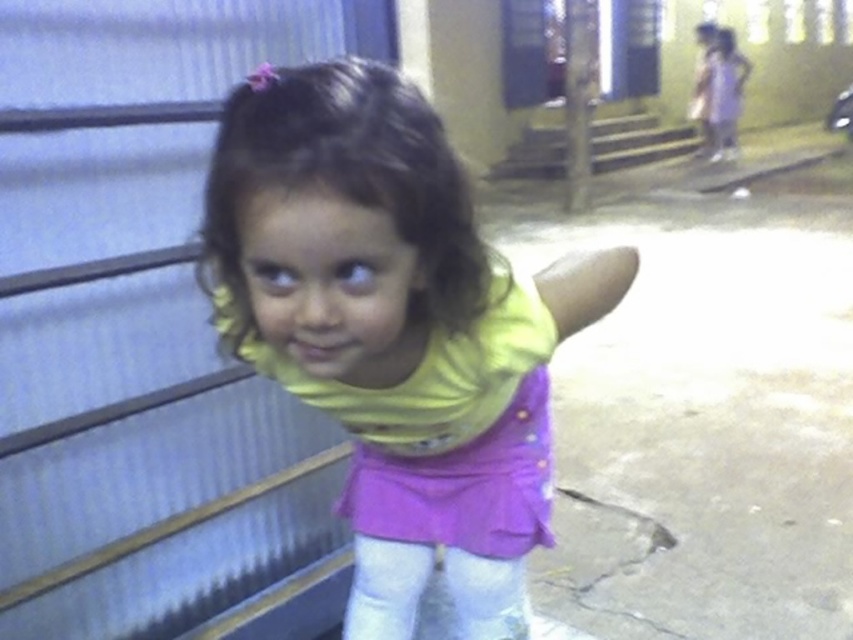
You are a delivery person trying to reach the entrance of the building. You see the metallic gray garage door at upper left and the yellow matte shirt at center. Which object is taller and would block your view of the entrance?

The metallic gray garage door at upper left is much taller than the yellow matte shirt at center, so it would block the view of the entrance.

Looking at this image, you are a delivery person trying to park your vehicle in the parking lot near the metallic gray garage door at upper left. You notice the yellow matte shirt at center is standing in the path. Can your vehicle pass safely without hitting the child?

The metallic gray garage door at upper left is wider than the yellow matte shirt at center. Since the garage door is wider, there should be enough space for the vehicle to maneuver around the child safely, provided the path isn